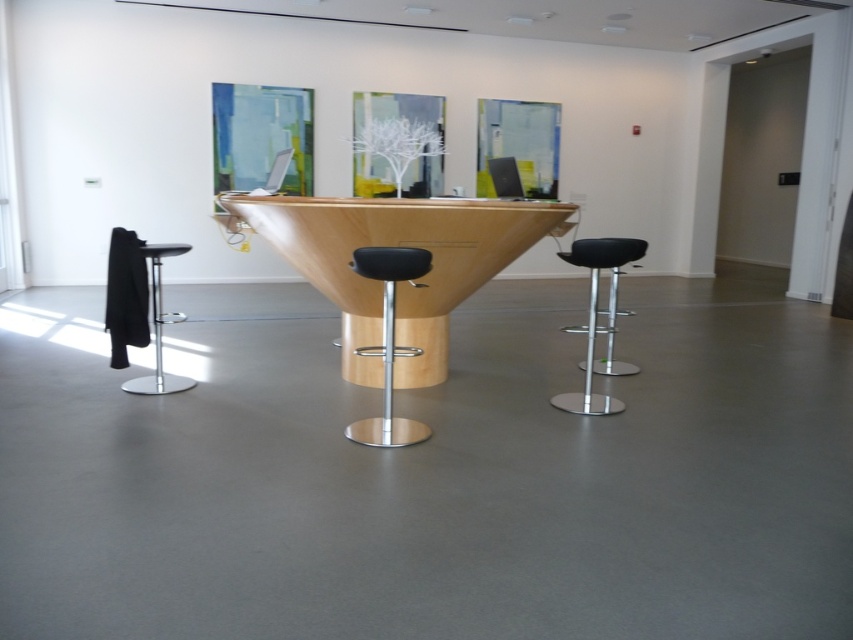
Does black leather bar stool at center have a larger size compared to black leather bar stool at right?

Actually, black leather bar stool at center might be smaller than black leather bar stool at right.

Does black leather bar stool at center appear on the right side of black leather bar stool at right?

In fact, black leather bar stool at center is to the left of black leather bar stool at right.

Who is more forward, (363, 420) or (595, 289)?

Positioned in front is point (363, 420).

Image resolution: width=853 pixels, height=640 pixels. I want to click on black leather bar stool at center, so click(387, 342).

Which is behind, point (590, 381) or point (177, 253)?

Positioned behind is point (177, 253).

Is black leather bar stool at right closer to the viewer compared to black leather bar stool at left?

Yes, it is in front of black leather bar stool at left.

Measure the distance between point (x=590, y=241) and camera.

Point (x=590, y=241) is 10.69 feet from camera.

Find the location of a particular element. black leather bar stool at right is located at coordinates (595, 316).

Locate an element on the screen. beech wood table at center is located at coordinates (397, 244).

Does beech wood table at center have a lesser height compared to black leather bar stool at right?

No, beech wood table at center is not shorter than black leather bar stool at right.

I want to click on beech wood table at center, so click(397, 244).